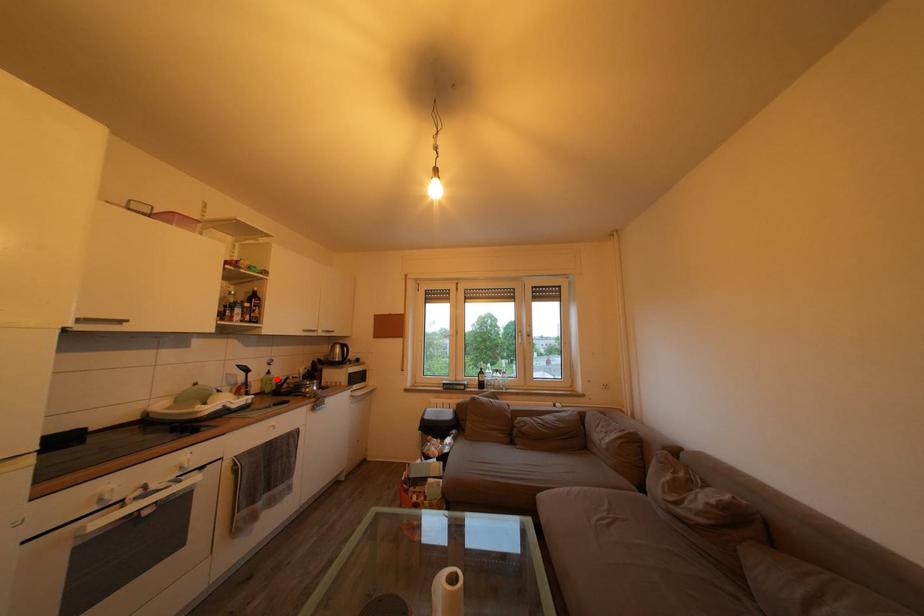
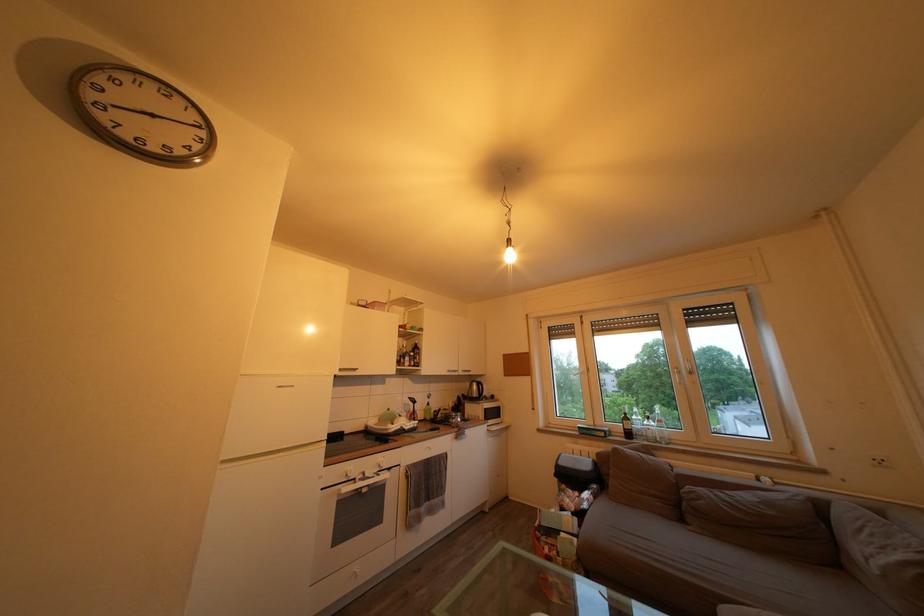
Question: A red point is marked in image1. In image2, is the corresponding 3D point closer to the camera or farther? Reply with the corresponding letter.

Choices:
 (A) The corresponding 3D point is closer.
 (B) The corresponding 3D point is farther.

Answer: (B)